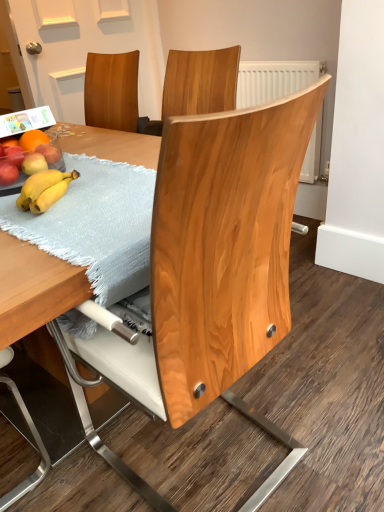
Question: Considering the relative positions of matte red apple at left, acting as the 1th apple starting from the front, and light blue textured placemat at table in the image provided, is matte red apple at left, acting as the 1th apple starting from the front, to the right of light blue textured placemat at table from the viewer's perspective?

Choices:
 (A) yes
 (B) no

Answer: (B)

Question: From the image's perspective, does matte red apple at left, arranged as the fourth apple when viewed from the back, appear higher than light blue textured placemat at table?

Choices:
 (A) yes
 (B) no

Answer: (A)

Question: Considering the relative sizes of matte red apple at left, acting as the 1th apple starting from the front, and light blue textured placemat at table in the image provided, is matte red apple at left, acting as the 1th apple starting from the front, thinner than light blue textured placemat at table?

Choices:
 (A) yes
 (B) no

Answer: (A)

Question: Is light blue textured placemat at table at the back of matte red apple at left, arranged as the fourth apple when viewed from the back?

Choices:
 (A) yes
 (B) no

Answer: (B)

Question: Can you confirm if matte red apple at left, arranged as the fourth apple when viewed from the back, is wider than light blue textured placemat at table?

Choices:
 (A) no
 (B) yes

Answer: (A)

Question: Considering the relative sizes of matte red apple at left, arranged as the fourth apple when viewed from the back, and light blue textured placemat at table in the image provided, is matte red apple at left, arranged as the fourth apple when viewed from the back, bigger than light blue textured placemat at table?

Choices:
 (A) yes
 (B) no

Answer: (B)

Question: Is the depth of natural wood chair at center greater than that of matte red apple at left, marked as the first apple in a back-to-front arrangement?

Choices:
 (A) no
 (B) yes

Answer: (A)

Question: From a real-world perspective, is natural wood chair at center positioned over matte red apple at left, the fourth apple when ordered from front to back, based on gravity?

Choices:
 (A) yes
 (B) no

Answer: (B)

Question: Is matte red apple at left, the fourth apple when ordered from front to back, completely or partially inside natural wood chair at center?

Choices:
 (A) no
 (B) yes

Answer: (A)

Question: Does natural wood chair at center appear on the right side of matte red apple at left, marked as the first apple in a back-to-front arrangement?

Choices:
 (A) yes
 (B) no

Answer: (A)

Question: Is the depth of natural wood chair at center less than that of matte red apple at left, the fourth apple when ordered from front to back?

Choices:
 (A) no
 (B) yes

Answer: (B)

Question: From the image's perspective, is natural wood chair at center on top of matte red apple at left, marked as the first apple in a back-to-front arrangement?

Choices:
 (A) no
 (B) yes

Answer: (A)

Question: Is light blue textured placemat at table further to the viewer compared to matte red apple at left, the fourth apple when ordered from front to back?

Choices:
 (A) no
 (B) yes

Answer: (A)